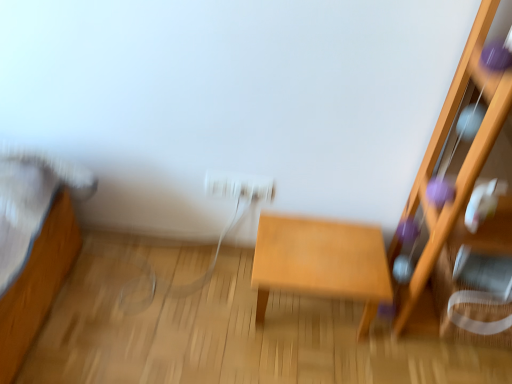
Question: From the image's perspective, is white glossy electric outlet at center below light brown wooden table at center?

Choices:
 (A) yes
 (B) no

Answer: (B)

Question: Is the position of white glossy electric outlet at center less distant than that of light brown wooden table at center?

Choices:
 (A) no
 (B) yes

Answer: (A)

Question: Is white glossy electric outlet at center bigger than light brown wooden table at center?

Choices:
 (A) yes
 (B) no

Answer: (B)

Question: From a real-world perspective, is white glossy electric outlet at center physically below light brown wooden table at center?

Choices:
 (A) no
 (B) yes

Answer: (A)

Question: Would you say white glossy electric outlet at center is a long distance from light brown wooden table at center?

Choices:
 (A) yes
 (B) no

Answer: (B)

Question: Does white glossy electric outlet at center have a greater width compared to light brown wooden table at center?

Choices:
 (A) yes
 (B) no

Answer: (B)

Question: Can you confirm if wooden shelf at right is wider than white glossy electric outlet at center?

Choices:
 (A) yes
 (B) no

Answer: (A)

Question: From a real-world perspective, does wooden shelf at right sit lower than white glossy electric outlet at center?

Choices:
 (A) no
 (B) yes

Answer: (A)

Question: From a real-world perspective, is wooden shelf at right located higher than white glossy electric outlet at center?

Choices:
 (A) yes
 (B) no

Answer: (A)

Question: Considering the relative sizes of wooden shelf at right and white glossy electric outlet at center in the image provided, is wooden shelf at right thinner than white glossy electric outlet at center?

Choices:
 (A) no
 (B) yes

Answer: (A)

Question: From the image's perspective, would you say wooden shelf at right is shown under white glossy electric outlet at center?

Choices:
 (A) yes
 (B) no

Answer: (A)

Question: Is wooden shelf at right bigger than white glossy electric outlet at center?

Choices:
 (A) yes
 (B) no

Answer: (A)

Question: Is light brown wooden table at center bigger than wooden shelf at right?

Choices:
 (A) no
 (B) yes

Answer: (A)